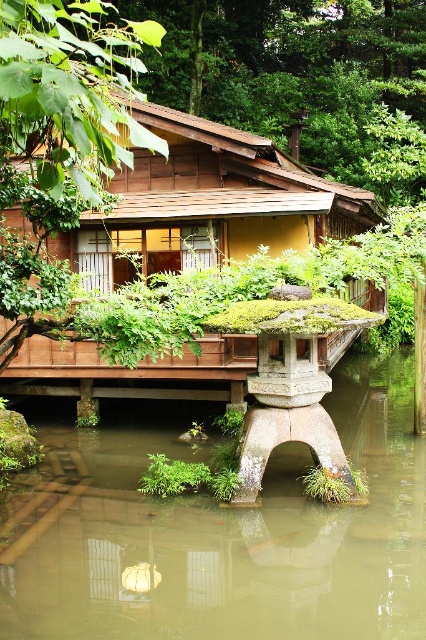
Is point (267, 618) in front of point (247, 237)?

That is True.

Can you confirm if green mossy stone at lower center is positioned to the right of wooden hut at center?

Correct, you'll find green mossy stone at lower center to the right of wooden hut at center.

Does point (23, 573) come closer to viewer compared to point (137, 204)?

That is True.

The height and width of the screenshot is (640, 426). Find the location of `green mossy stone at lower center`. green mossy stone at lower center is located at coordinates (226, 534).